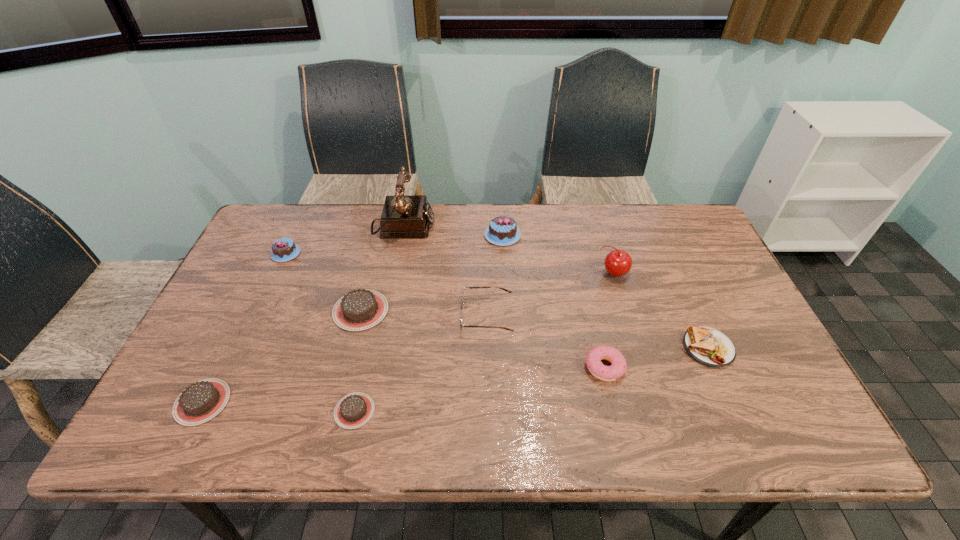
Image resolution: width=960 pixels, height=540 pixels. What are the coordinates of `free space between the right pink chocolate cake and the beige sandwich` in the screenshot? It's located at (605, 292).

At what (x,y) coordinates should I click in order to perform the action: click on empty location between the seventh nearest object and the second smallest brown chocolate cake. Please return your answer as a coordinate pair (x, y). Looking at the image, I should click on (408, 338).

Find the location of a particular element. This screenshot has height=540, width=960. vacant space that's between the shortest chocolate cake and the rightmost object is located at coordinates tap(531, 379).

Identify the location of unoccupied position between the right pink chocolate cake and the left pink chocolate cake. The image size is (960, 540). (395, 244).

At what (x,y) coordinates should I click in order to perform the action: click on vacant area that lies between the second biggest brown chocolate cake and the cherry. Please return your answer as a coordinate pair (x, y). This screenshot has width=960, height=540. Looking at the image, I should click on (408, 338).

Locate an element on the screen. free space that is in between the pink doughnut and the brown spectacles is located at coordinates (545, 341).

In order to click on free area in between the farthest brown chocolate cake and the fourth tallest chocolate cake in this screenshot , I will do `click(281, 356)`.

At what (x,y) coordinates should I click in order to perform the action: click on free spot between the sandwich and the second shortest chocolate cake. Please return your answer as a coordinate pair (x, y). This screenshot has height=540, width=960. Looking at the image, I should click on (455, 375).

Locate an element on the screen. This screenshot has height=540, width=960. object identified as the fourth closest to the rightmost object is located at coordinates (502, 230).

Where is `object that ranks as the sixth closest to the shortest chocolate cake`? object that ranks as the sixth closest to the shortest chocolate cake is located at coordinates (403, 216).